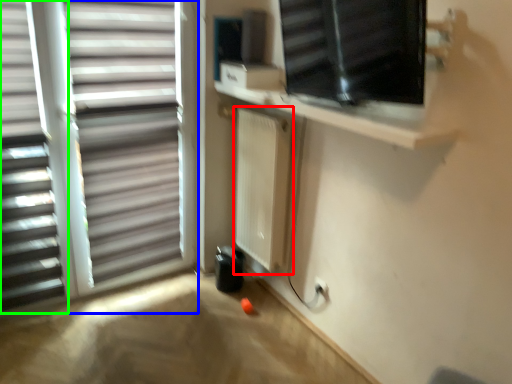
Question: Considering the real-world distances, which object is farthest from radiator (highlighted by a red box)? window (highlighted by a blue box) or window blind (highlighted by a green box)?

Choices:
 (A) window
 (B) window blind

Answer: (B)